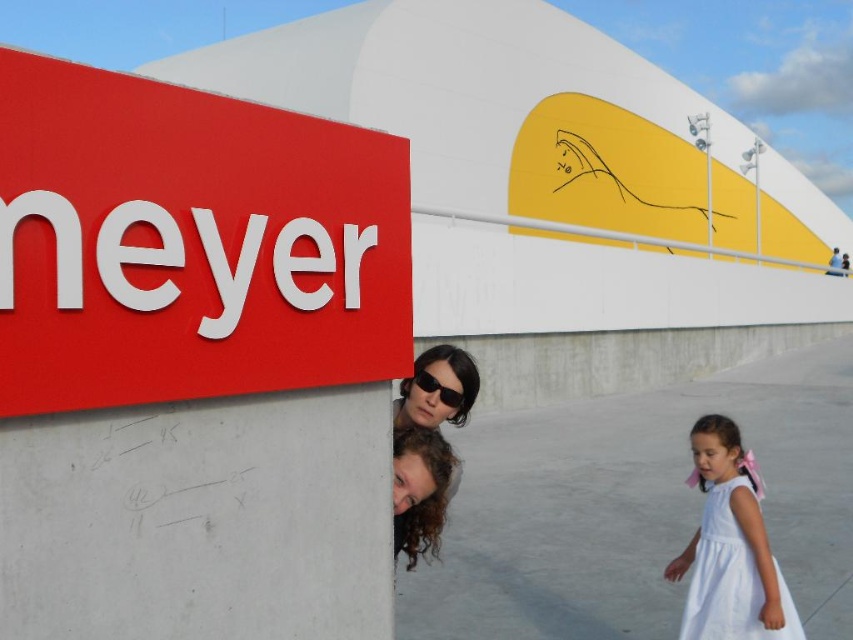
Question: Which of these objects is positioned farthest from the matte white sign at upper left?

Choices:
 (A) white satin dress at lower right
 (B) black plastic sunglasses at center

Answer: (A)

Question: Is white satin dress at lower right positioned behind black plastic sunglasses at center?

Choices:
 (A) no
 (B) yes

Answer: (B)

Question: Is the position of white satin dress at lower right less distant than that of black plastic sunglasses at center?

Choices:
 (A) no
 (B) yes

Answer: (A)

Question: Which of the following is the farthest from the observer?

Choices:
 (A) white satin dress at lower right
 (B) matte white sign at upper left

Answer: (A)

Question: Does matte white sign at upper left have a larger size compared to white satin dress at lower right?

Choices:
 (A) no
 (B) yes

Answer: (B)

Question: Among these points, which one is nearest to the camera?

Choices:
 (A) (39, 106)
 (B) (717, 618)

Answer: (A)